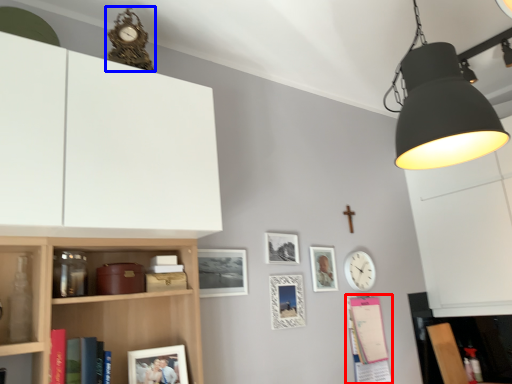
Question: Which point is further to the camera, book (highlighted by a red box) or clock (highlighted by a blue box)?

Choices:
 (A) book
 (B) clock

Answer: (A)